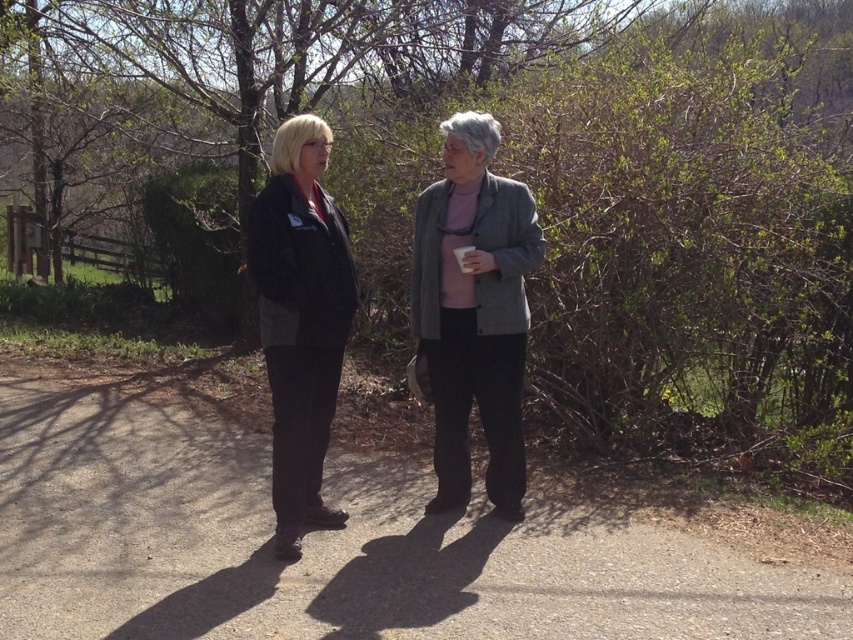
Can you confirm if gray asphalt path at center is taller than gray woolen blazer at center?

Incorrect, gray asphalt path at center's height is not larger of gray woolen blazer at center's.

Who is more forward, [102,435] or [448,289]?

Positioned in front is point [448,289].

Image resolution: width=853 pixels, height=640 pixels. Identify the location of gray asphalt path at center. (338, 545).

Is gray woolen blazer at center taller than black matte suit at center?

Yes.

Is point (503, 314) more distant than point (291, 492)?

Yes, point (503, 314) is behind point (291, 492).

What are the coordinates of `gray woolen blazer at center` in the screenshot? It's located at [x=474, y=326].

Which is more to the left, gray asphalt path at center or black matte suit at center?

black matte suit at center

Consider the image. Is gray asphalt path at center smaller than black matte suit at center?

Yes, gray asphalt path at center is smaller than black matte suit at center.

The width and height of the screenshot is (853, 640). Describe the element at coordinates (338, 545) in the screenshot. I see `gray asphalt path at center` at that location.

The width and height of the screenshot is (853, 640). In order to click on gray asphalt path at center in this screenshot , I will do `click(338, 545)`.